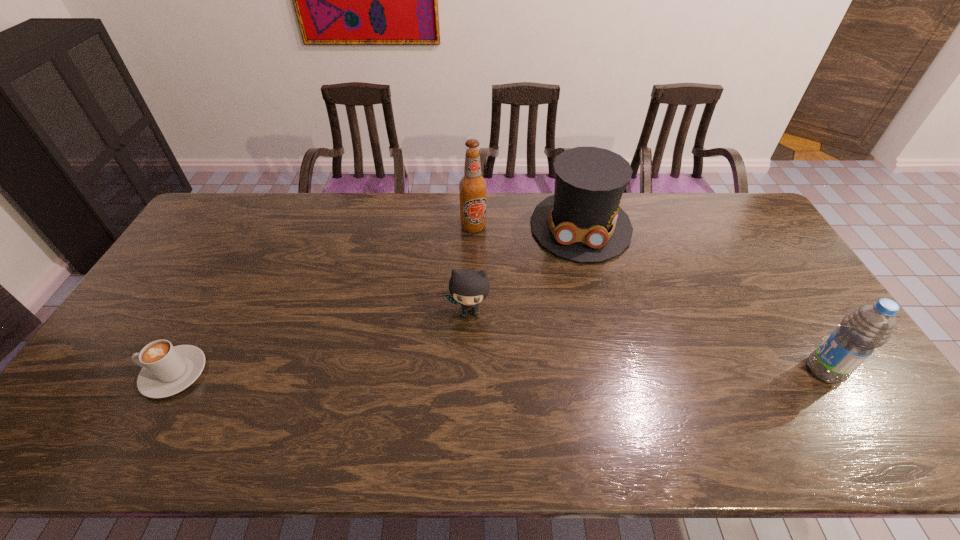
The image size is (960, 540). Identify the location of free space at the far left corner of the desktop. (235, 200).

I want to click on blank region between the cappuccino and the fourth object from left to right, so click(377, 300).

The height and width of the screenshot is (540, 960). In order to click on vacant area between the beer bottle and the kitten in this screenshot , I will do `click(471, 269)`.

Locate an element on the screen. The height and width of the screenshot is (540, 960). vacant space that is in between the rightmost object and the second object from right to left is located at coordinates (703, 298).

This screenshot has width=960, height=540. I want to click on vacant point located between the water bottle and the second shortest object, so click(647, 341).

Identify the location of unoccupied area between the beer bottle and the third farthest object. Image resolution: width=960 pixels, height=540 pixels. (471, 269).

At what (x,y) coordinates should I click in order to perform the action: click on blank region between the leftmost object and the water bottle. Please return your answer as a coordinate pair (x, y). The image size is (960, 540). Looking at the image, I should click on [499, 372].

Find the location of a particular element. The image size is (960, 540). vacant area between the cappuccino and the beer bottle is located at coordinates (324, 300).

Where is `free spot between the leftmost object and the dress hat`? This screenshot has width=960, height=540. free spot between the leftmost object and the dress hat is located at coordinates (377, 300).

I want to click on vacant space that's between the dress hat and the rightmost object, so click(x=703, y=298).